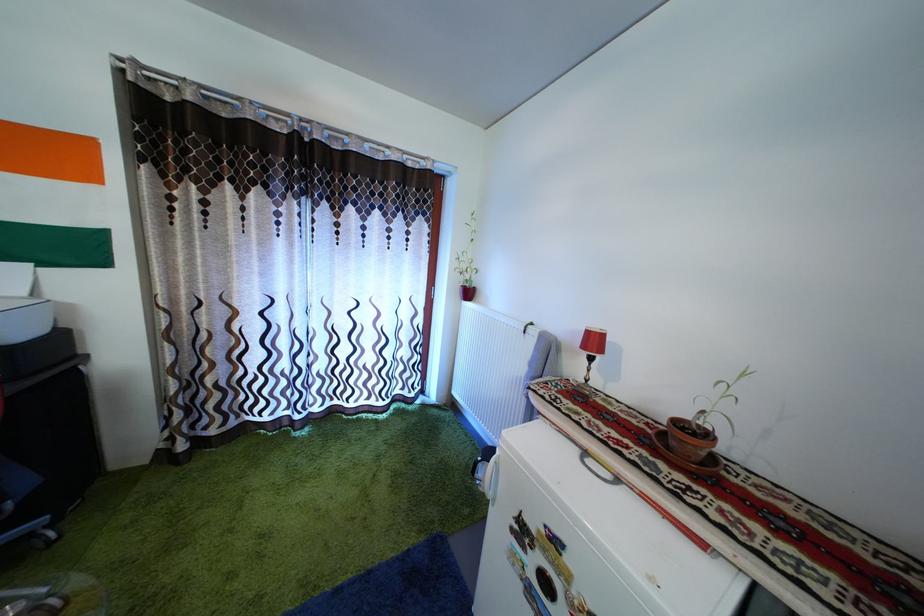
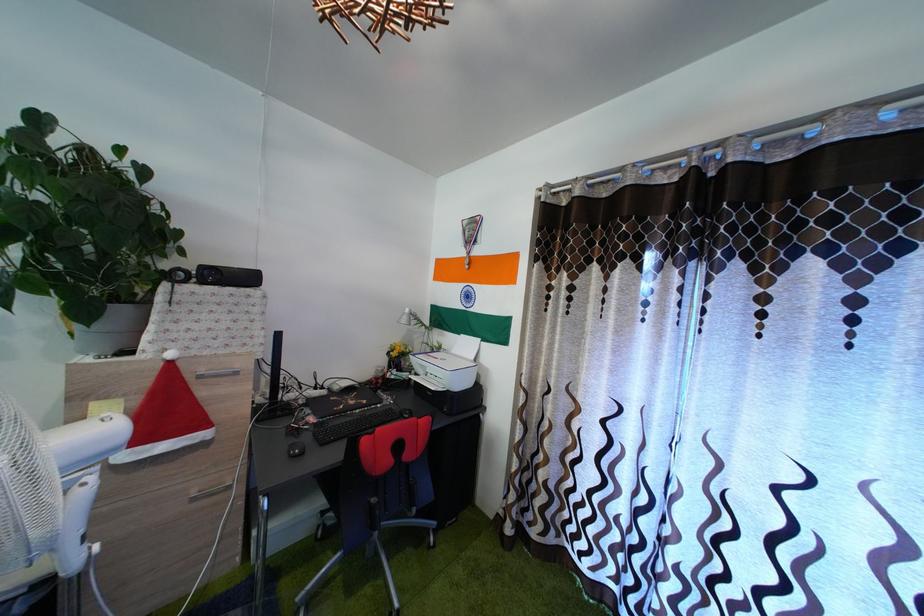
Question: The camera is either moving clockwise (left) or counter-clockwise (right) around the object. The first image is from the beginning of the video and the second image is from the end. Is the camera moving left or right when shooting the video?

Choices:
 (A) Left
 (B) Right

Answer: (B)